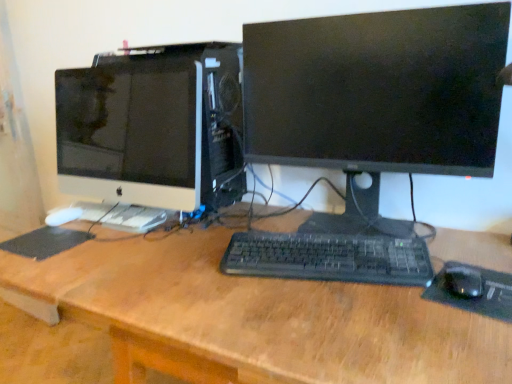
This screenshot has width=512, height=384. What are the coordinates of `free location in front of black matte monitor at center, which is counted as the first computer monitor, starting from the right` in the screenshot? It's located at (x=345, y=321).